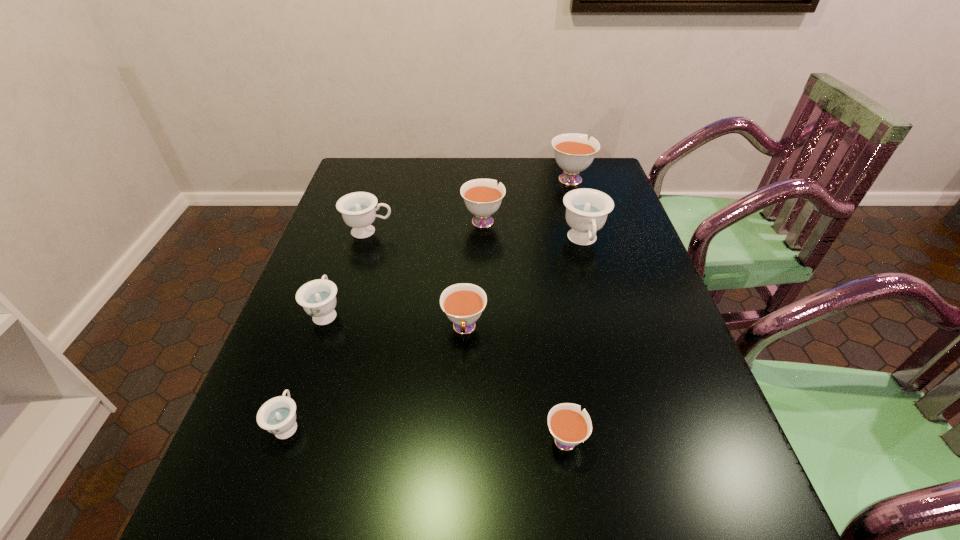
This screenshot has width=960, height=540. Find the location of `free location located on the side of the second white teacup from right to left with the handle`. free location located on the side of the second white teacup from right to left with the handle is located at coordinates (550, 341).

The height and width of the screenshot is (540, 960). In order to click on free space located on the side of the second white teacup from right to left with the handle in this screenshot , I will do `click(552, 351)`.

At what (x,y) coordinates should I click in order to perform the action: click on free point located on the side of the smallest blue teacup with the handle. Please return your answer as a coordinate pair (x, y). This screenshot has width=960, height=540. Looking at the image, I should click on (328, 306).

You are a GUI agent. You are given a task and a screenshot of the screen. Output one action in this format:
    pyautogui.click(x=<x>, y=<y>)
    Task: Click on the vacant space situated on the side of the smallest blue teacup with the handle
    
    Given the screenshot: What is the action you would take?
    313,352

Image resolution: width=960 pixels, height=540 pixels. In order to click on blank space located 0.100m on the side of the smallest blue teacup with the handle in this screenshot , I will do `click(309, 363)`.

Locate an element on the screen. The image size is (960, 540). object located at the far edge is located at coordinates (573, 153).

At what (x,y) coordinates should I click in order to perform the action: click on object present at the far right corner. Please return your answer as a coordinate pair (x, y). Looking at the image, I should click on (573, 153).

Image resolution: width=960 pixels, height=540 pixels. Find the location of `vacant space at the far edge of the desktop`. vacant space at the far edge of the desktop is located at coordinates (516, 193).

This screenshot has width=960, height=540. Find the location of `vacant region at the near edge`. vacant region at the near edge is located at coordinates [658, 534].

Locate an element on the screen. free spot at the left edge of the desktop is located at coordinates (219, 502).